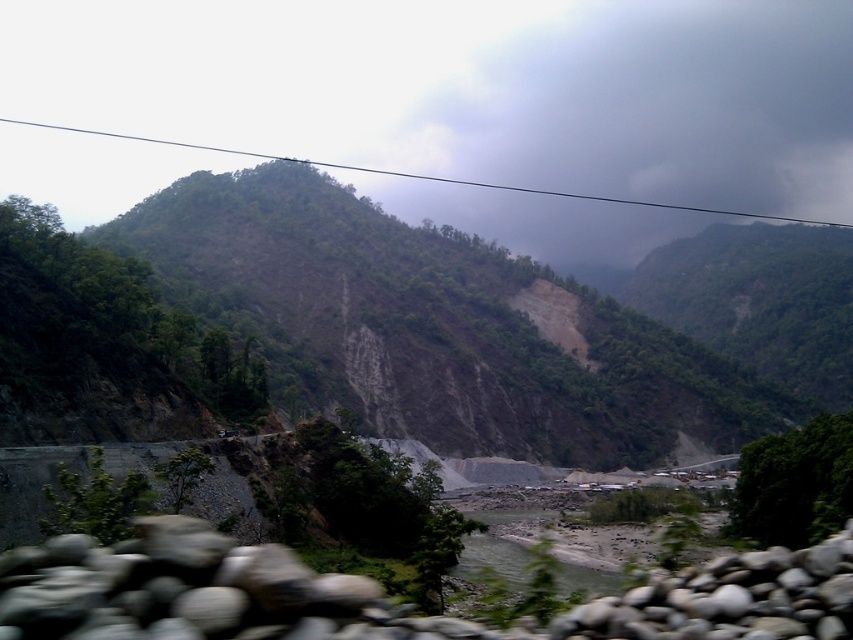
Question: Does gray smooth stones at lower right appear on the left side of brown sandy river at center?

Choices:
 (A) no
 (B) yes

Answer: (B)

Question: Which of the following is the farthest from the observer?

Choices:
 (A) (837, 616)
 (B) (781, 163)
 (C) (569, 540)

Answer: (B)

Question: Can you confirm if dark gray cloud at upper center is positioned to the left of gray smooth stones at lower right?

Choices:
 (A) no
 (B) yes

Answer: (A)

Question: Which object is the closest to the brown sandy river at center?

Choices:
 (A) gray smooth stones at lower right
 (B) dark gray cloud at upper center

Answer: (A)

Question: Where is dark gray cloud at upper center located in relation to brown sandy river at center in the image?

Choices:
 (A) below
 (B) above

Answer: (B)

Question: Which of the following is the farthest from the observer?

Choices:
 (A) brown sandy river at center
 (B) gray smooth stones at lower right

Answer: (A)